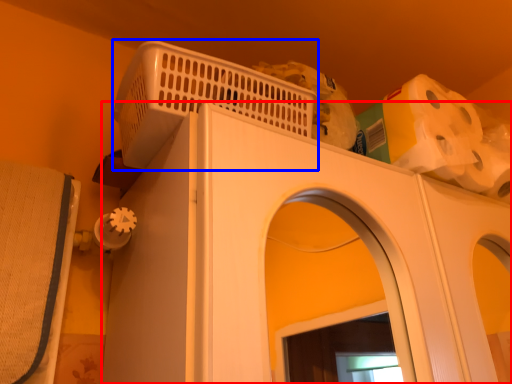
Question: Which point is further to the camera, home appliance (highlighted by a red box) or basket (highlighted by a blue box)?

Choices:
 (A) home appliance
 (B) basket

Answer: (B)